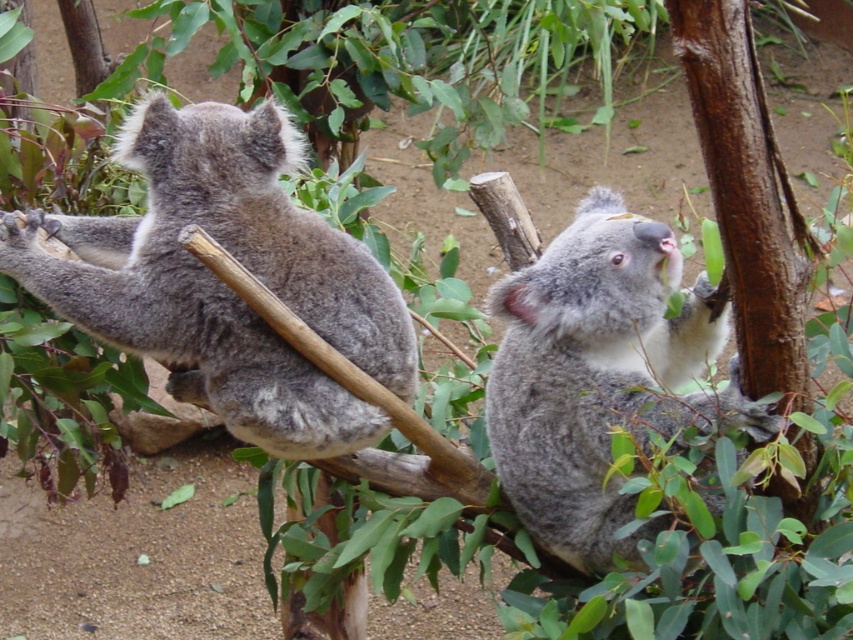
You are a zookeeper observing the gray furry koala at left in its enclosure. Based on its position coordinates, can you determine if it is closer to the left edge of the enclosure or the right edge?

The gray furry koala at left is positioned at coordinates point (224, 284), which places it closer to the left edge of the enclosure since the x coordinate is less than 0.5.

You are a zookeeper observing two koalas in their enclosure. You notice a gray furry koala at left and another koala at right. You want to place a feeding tray at point (224,284). Is there already an animal at that location?

Yes, there is already a gray furry koala at left at point (224,284), so placing the feeding tray there would disturb the animal.

You are a zookeeper observing the two koalas in their enclosure. You need to approach the gray furry koala at left and the fuzzy gray koala at upper right to check their health. Which koala should you approach first to minimize disturbance?

You should approach the gray furry koala at left first because it is closer to you than the fuzzy gray koala at upper right, so it will be less disruptive to move closer to the nearer one first.